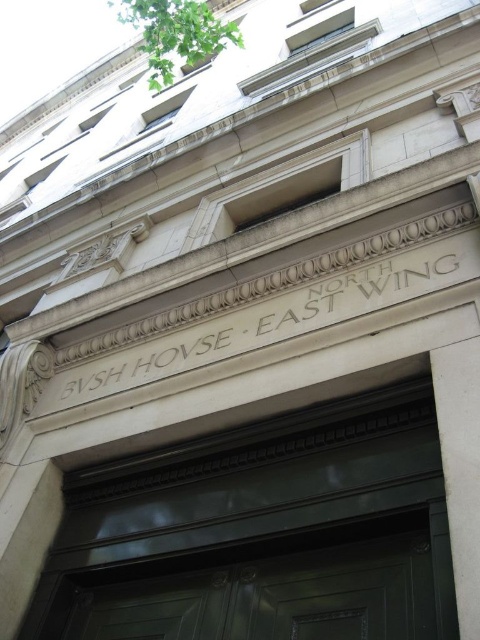
Question: Which point is closer to the camera?

Choices:
 (A) white stone engraving at center
 (B) white marble pillar at center

Answer: (B)

Question: From the image, what is the correct spatial relationship of green polished wood door at center in relation to white stone engraving at center?

Choices:
 (A) right
 (B) left

Answer: (A)

Question: Does green polished wood door at center have a lesser width compared to white marble pillar at center?

Choices:
 (A) yes
 (B) no

Answer: (B)

Question: Which object is positioned farthest from the green polished wood door at center?

Choices:
 (A) white marble pillar at center
 (B) white stone engraving at center

Answer: (B)

Question: Among these objects, which one is farthest from the camera?

Choices:
 (A) green polished wood door at center
 (B) white stone engraving at center
 (C) white marble pillar at center

Answer: (B)

Question: In this image, where is green polished wood door at center located relative to white stone engraving at center?

Choices:
 (A) below
 (B) above

Answer: (A)